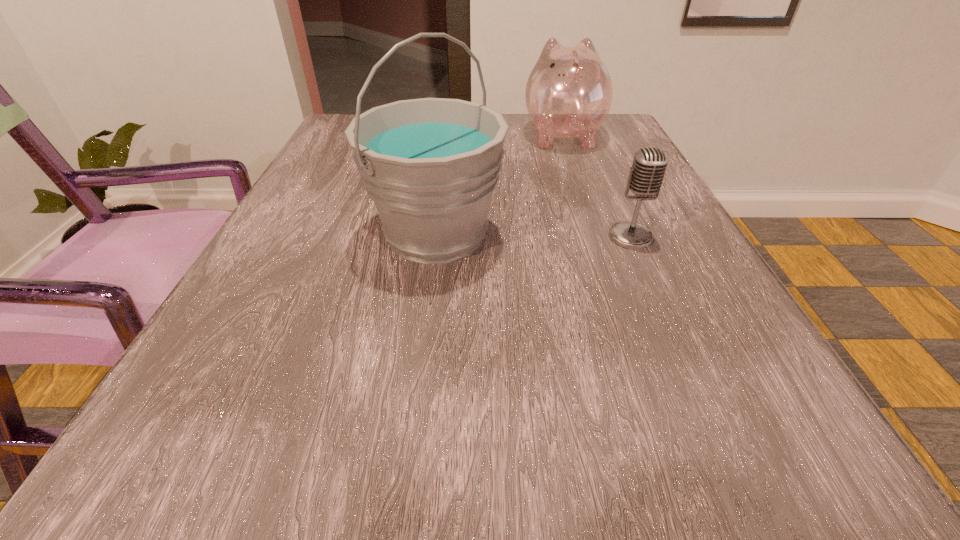
Image resolution: width=960 pixels, height=540 pixels. What are the coordinates of `object located in the far right corner section of the desktop` in the screenshot? It's located at (569, 91).

The height and width of the screenshot is (540, 960). In order to click on vacant point at the far edge in this screenshot , I will do coord(526,133).

Where is `vacant space at the near edge of the desktop`? vacant space at the near edge of the desktop is located at coordinates (656, 437).

At what (x,y) coordinates should I click in order to perform the action: click on vacant space at the left edge of the desktop. Please return your answer as a coordinate pair (x, y). This screenshot has height=540, width=960. Looking at the image, I should click on (255, 307).

You are a GUI agent. You are given a task and a screenshot of the screen. Output one action in this format:
    pyautogui.click(x=<x>, y=<y>)
    Task: Click on the vacant space at the right edge
    
    Given the screenshot: What is the action you would take?
    coord(647,212)

Identify the location of free space at the far left corner. The image size is (960, 540). (332, 130).

In the image, there is a desktop. Where is `vacant space at the far right corner`? The image size is (960, 540). vacant space at the far right corner is located at coordinates (620, 131).

Find the location of a particular element. The height and width of the screenshot is (540, 960). empty space that is in between the piggy bank and the leftmost object is located at coordinates click(499, 184).

The width and height of the screenshot is (960, 540). In order to click on vacant area that lies between the tallest object and the farthest object in this screenshot , I will do `click(499, 184)`.

Where is `vacant region between the leftmost object and the second tallest object`? This screenshot has height=540, width=960. vacant region between the leftmost object and the second tallest object is located at coordinates (499, 184).